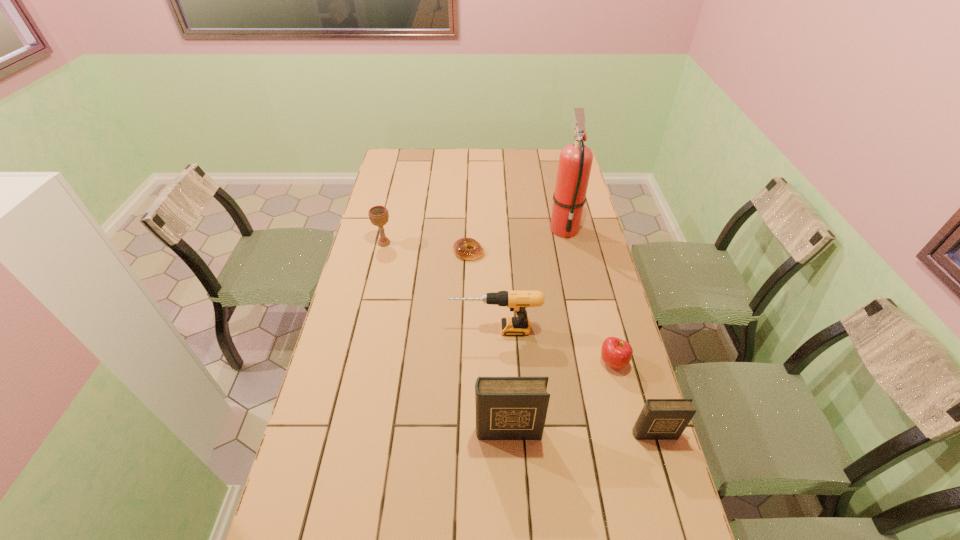
The width and height of the screenshot is (960, 540). In order to click on vacant area that satisfies the following two spatial constraints: 1. on the hose direction of the fire extinguisher; 2. on the left side of the second shortest object in this screenshot , I will do `click(593, 362)`.

The image size is (960, 540). I want to click on free spot that satisfies the following two spatial constraints: 1. on the front side of the chalice; 2. on the left side of the apple, so click(356, 362).